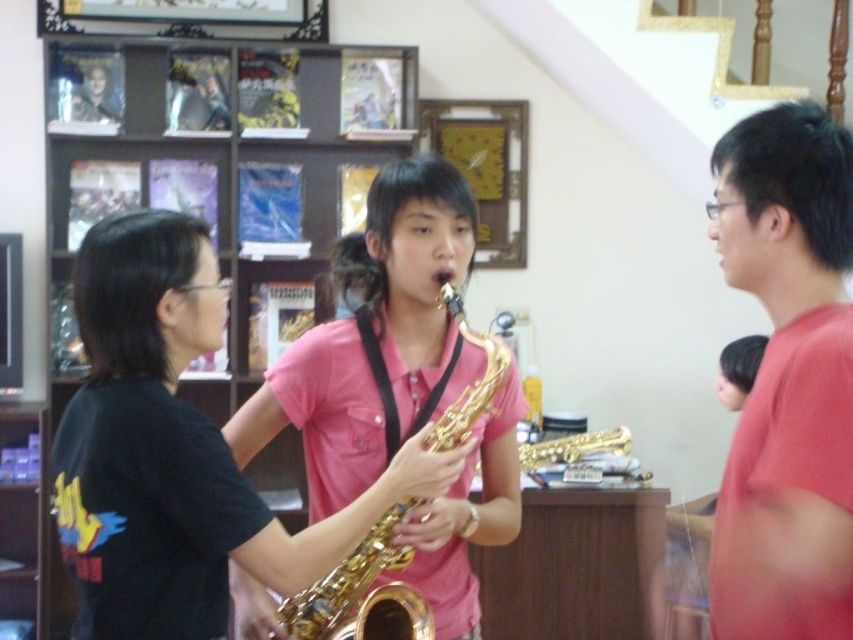
Does point (450, 310) come farther from viewer compared to point (505, 145)?

No, it is not.

Does gold shiny trumpet at center appear under wooden frame at upper center?

Correct, gold shiny trumpet at center is located below wooden frame at upper center.

Is point (376, 524) positioned in front of point (498, 154)?

Yes.

You are a GUI agent. You are given a task and a screenshot of the screen. Output one action in this format:
    pyautogui.click(x=<x>, y=<y>)
    Task: Click on the gold shiny trumpet at center
    This screenshot has height=640, width=853.
    Given the screenshot: What is the action you would take?
    pyautogui.click(x=347, y=582)

Who is positioned more to the left, gold shiny saxophone at center or gold shiny trumpet at center?

Positioned to the left is gold shiny saxophone at center.

Does gold shiny saxophone at center appear on the right side of gold shiny trumpet at center?

In fact, gold shiny saxophone at center is to the left of gold shiny trumpet at center.

Is point (260, 513) more distant than point (352, 604)?

No.

Locate an element on the screen. gold shiny saxophone at center is located at coordinates (175, 451).

Is matte red shirt at right smaller than wooden frame at upper center?

Incorrect, matte red shirt at right is not smaller in size than wooden frame at upper center.

Who is taller, matte red shirt at right or wooden frame at upper center?

matte red shirt at right is taller.

Locate an element on the screen. matte red shirt at right is located at coordinates (787, 378).